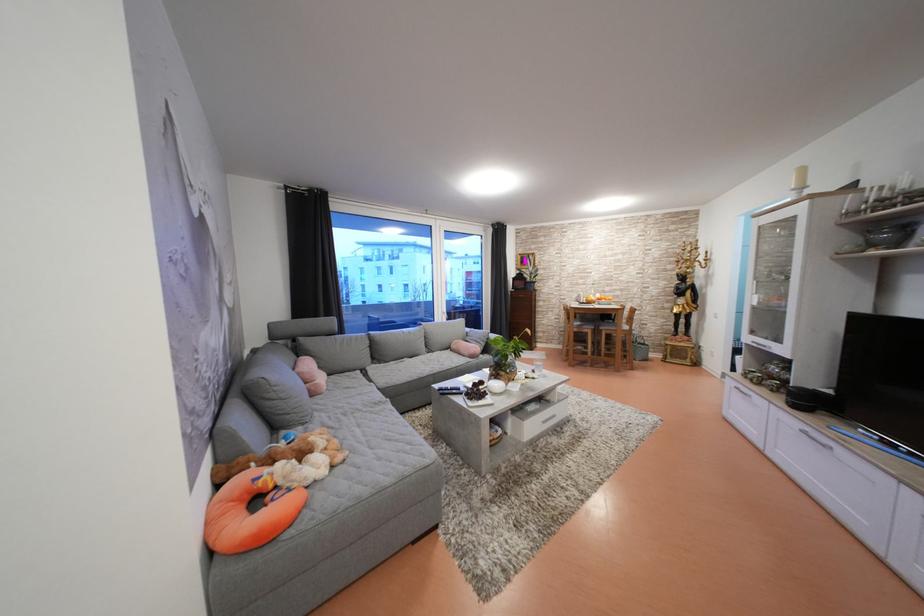
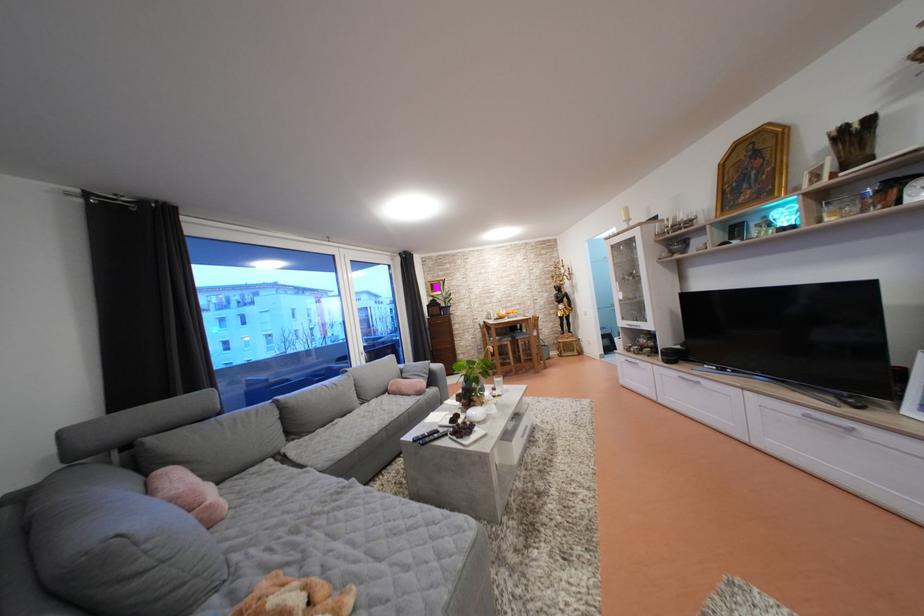
The point at (335, 379) is marked in the first image. Where is the corresponding point in the second image?

(225, 488)